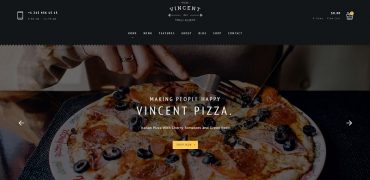
This screenshot has height=180, width=370. Identify the location of plate. pos(63,154).